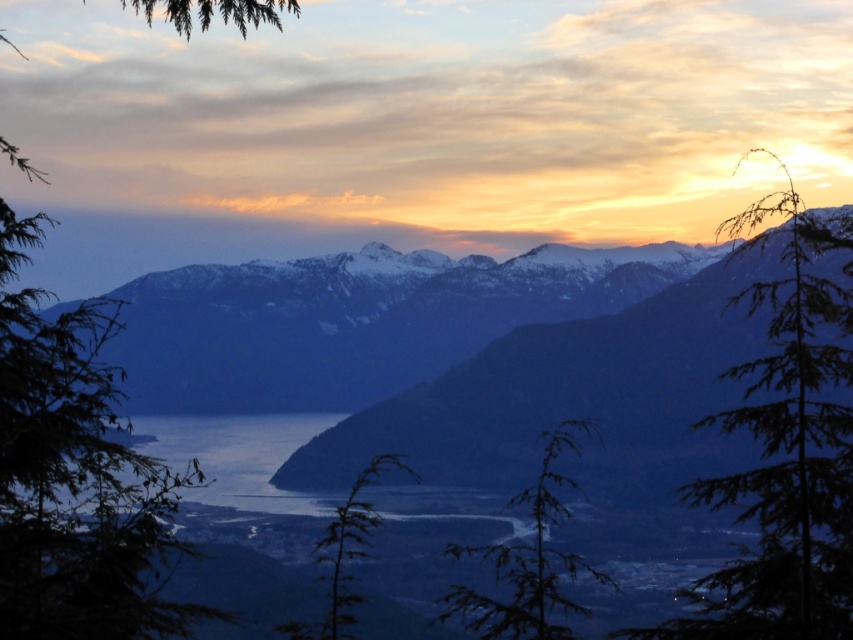
You are standing in the mountain landscape and see the green matte tree at left and the green fuzzy plant at center. Which one is positioned more to the east if the sun is setting in the west?

The green matte tree at left is positioned more to the east because it is to the left of the green fuzzy plant at center, and since the sun is setting in the west, the eastern side would be on the left side of the image.

You are standing at the edge of the mountain landscape scene and want to estimate how far the snowy mountain range at center is from your current position. Based on the information provided, what is the approximate distance in feet?

The snowy mountain range at center is approximately 1865.85 feet away from the viewer.

Based on the scene description, where is the snowy mountain range at center located in terms of its 2D coordinates?

The snowy mountain range at center is located at the 2D coordinates of point (357,321).